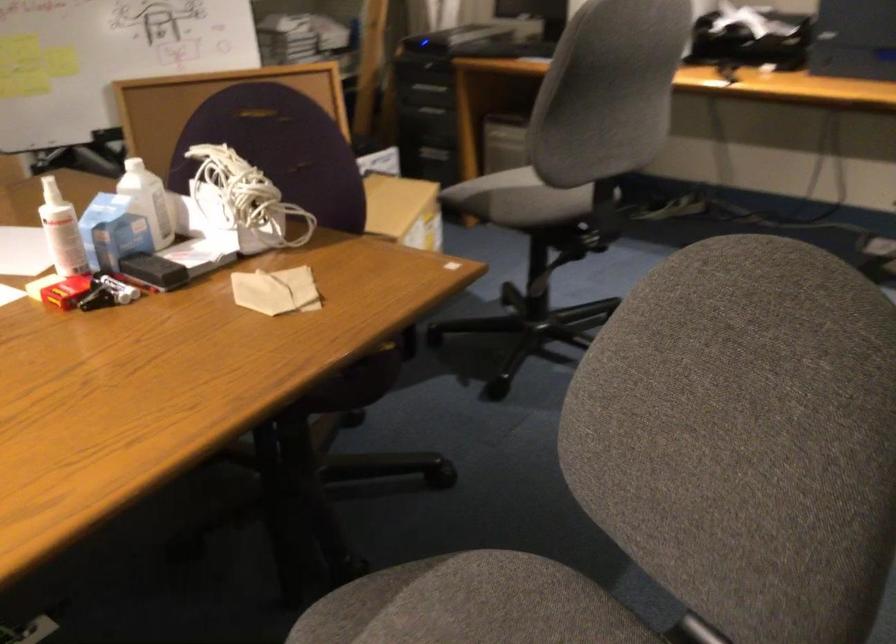
Identify the location of black stapler. This screenshot has height=644, width=896. [x=152, y=270].